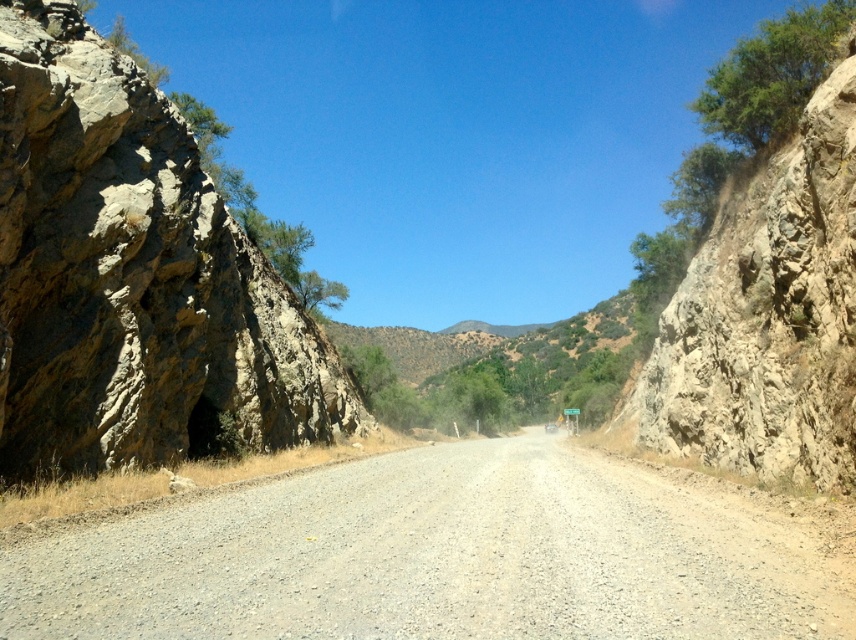
Does point (275, 512) come closer to viewer compared to point (198, 220)?

Yes, point (275, 512) is closer to viewer.

Can you confirm if gray gravel road at center is positioned below rusty rock formation at left?

Indeed, gray gravel road at center is positioned under rusty rock formation at left.

Who is more distant from viewer, (513, 589) or (278, 435)?

Positioned behind is point (278, 435).

Where is `gray gravel road at center`? The image size is (856, 640). gray gravel road at center is located at coordinates (434, 557).

Is gray gravel road at center positioned at the back of rugged stone cliff at right?

No, it is in front of rugged stone cliff at right.

Who is positioned more to the right, gray gravel road at center or rugged stone cliff at right?

From the viewer's perspective, rugged stone cliff at right appears more on the right side.

Where is `gray gravel road at center`? gray gravel road at center is located at coordinates (434, 557).

Is rusty rock formation at left smaller than rugged stone cliff at right?

No.

Is point (108, 168) closer to viewer compared to point (767, 436)?

No, (108, 168) is behind (767, 436).

The width and height of the screenshot is (856, 640). Identify the location of rusty rock formation at left. (132, 276).